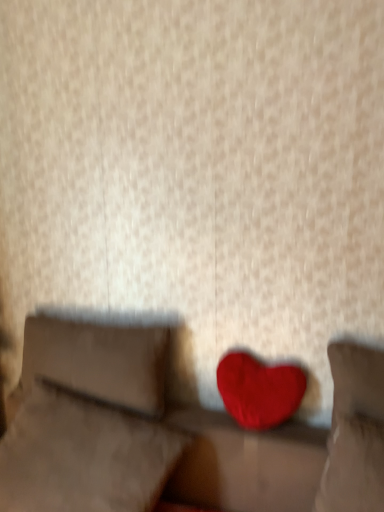
What do you see at coordinates (99, 361) in the screenshot? This screenshot has height=512, width=384. I see `suede-like beige pillow at left, the 1th pillow when ordered from left to right` at bounding box center [99, 361].

Locate an element on the screen. This screenshot has height=512, width=384. velvet red heart at center, arranged as the second pillow when viewed from the left is located at coordinates (83, 457).

Is velvet red heart at center, acting as the second pillow starting from the right, bigger than suede-like beige pillow at left, the third pillow positioned from the right?

Indeed, velvet red heart at center, acting as the second pillow starting from the right, has a larger size compared to suede-like beige pillow at left, the third pillow positioned from the right.

From the image's perspective, starting from the velvet red heart at center, acting as the second pillow starting from the right, which pillow is the 2nd one above? Please provide its 2D coordinates.

[(99, 361)]

Based on the photo, which object is positioned more to the left, velvet red heart at center, arranged as the second pillow when viewed from the left, or suede-like beige pillow at left, the third pillow positioned from the right?

suede-like beige pillow at left, the third pillow positioned from the right, is more to the left.

Is velvet red heart at center, acting as the second pillow starting from the right, positioned with its back to suede-like beige pillow at left, the third pillow positioned from the right?

Yes, velvet red heart at center, acting as the second pillow starting from the right, is positioned with its back facing suede-like beige pillow at left, the third pillow positioned from the right.

Which of these two, velvet red heart at center or velvet red heart at center, which appears as the 1th pillow when viewed from the right, is bigger?

With larger size is velvet red heart at center.

Where is `pillow lying on the right of velvet red heart at center`? This screenshot has height=512, width=384. pillow lying on the right of velvet red heart at center is located at coordinates (355, 431).

Is velvet red heart at center located outside velvet red heart at center, which ranks as the third pillow in left-to-right order?

Yes, velvet red heart at center is outside of velvet red heart at center, which ranks as the third pillow in left-to-right order.

Considering the relative sizes of velvet red heart at center and velvet red heart at center, which appears as the 1th pillow when viewed from the right, in the image provided, is velvet red heart at center shorter than velvet red heart at center, which appears as the 1th pillow when viewed from the right,?

No.

Can you confirm if velvet red heart at center, which appears as the 1th pillow when viewed from the right, is positioned to the left of velvet red heart at center?

In fact, velvet red heart at center, which appears as the 1th pillow when viewed from the right, is to the right of velvet red heart at center.

Between velvet red heart at center, which appears as the 1th pillow when viewed from the right, and velvet red heart at center, which one has larger size?

With larger size is velvet red heart at center.

How many degrees apart are the facing directions of velvet red heart at center, which ranks as the third pillow in left-to-right order, and velvet red heart at center?

0.98 degrees separate the facing orientations of velvet red heart at center, which ranks as the third pillow in left-to-right order, and velvet red heart at center.

Would you say velvet red heart at center, which ranks as the third pillow in left-to-right order, is outside velvet red heart at center?

Indeed, velvet red heart at center, which ranks as the third pillow in left-to-right order, is completely outside velvet red heart at center.

From the image's perspective, is velvet red heart at center, which ranks as the third pillow in left-to-right order, above velvet red heart at center, arranged as the second pillow when viewed from the left?

Correct, velvet red heart at center, which ranks as the third pillow in left-to-right order, appears higher than velvet red heart at center, arranged as the second pillow when viewed from the left, in the image.

In the image, is velvet red heart at center, which ranks as the third pillow in left-to-right order, on the left side or the right side of velvet red heart at center, acting as the second pillow starting from the right?

Based on their positions, velvet red heart at center, which ranks as the third pillow in left-to-right order, is located to the right of velvet red heart at center, acting as the second pillow starting from the right.

Is the surface of velvet red heart at center, which ranks as the third pillow in left-to-right order, in direct contact with velvet red heart at center, acting as the second pillow starting from the right?

They are not placed beside each other.

Considering the sizes of objects velvet red heart at center, which appears as the 1th pillow when viewed from the right, and velvet red heart at center, arranged as the second pillow when viewed from the left, in the image provided, who is smaller, velvet red heart at center, which appears as the 1th pillow when viewed from the right, or velvet red heart at center, arranged as the second pillow when viewed from the left,?

velvet red heart at center, which appears as the 1th pillow when viewed from the right.

From the picture: Is matte red heart at center facing towards velvet red heart at center, acting as the second pillow starting from the right?

No, matte red heart at center is not aimed at velvet red heart at center, acting as the second pillow starting from the right.

Is velvet red heart at center, arranged as the second pillow when viewed from the left, located within matte red heart at center?

No, matte red heart at center does not contain velvet red heart at center, arranged as the second pillow when viewed from the left.

Which object is closer to the camera taking this photo, matte red heart at center or velvet red heart at center, arranged as the second pillow when viewed from the left?

velvet red heart at center, arranged as the second pillow when viewed from the left, is closer to the camera.

In terms of size, does matte red heart at center appear bigger or smaller than velvet red heart at center, acting as the second pillow starting from the right?

Considering their sizes, matte red heart at center takes up less space than velvet red heart at center, acting as the second pillow starting from the right.

From the image's perspective, is velvet red heart at center, arranged as the second pillow when viewed from the left, below velvet red heart at center, which appears as the 1th pillow when viewed from the right?

Correct, velvet red heart at center, arranged as the second pillow when viewed from the left, appears lower than velvet red heart at center, which appears as the 1th pillow when viewed from the right, in the image.

Can you see velvet red heart at center, acting as the second pillow starting from the right, touching velvet red heart at center, which appears as the 1th pillow when viewed from the right?

No.

Could you tell me if velvet red heart at center, acting as the second pillow starting from the right, is turned towards velvet red heart at center, which appears as the 1th pillow when viewed from the right?

No, velvet red heart at center, acting as the second pillow starting from the right, does not turn towards velvet red heart at center, which appears as the 1th pillow when viewed from the right.

Is matte red heart at center wider than velvet red heart at center?

In fact, matte red heart at center might be narrower than velvet red heart at center.

Is there a large distance between matte red heart at center and velvet red heart at center?

No, matte red heart at center is not far from velvet red heart at center.

Is point (237, 420) closer or farther from the camera than point (101, 397)?

Point (237, 420) is positioned closer to the camera compared to point (101, 397).

At what (x,y) coordinates should I click in order to perform the action: click on pillow that is under the suede-like beige pillow at left, the third pillow positioned from the right (from a real-world perspective). Please return your answer as a coordinate pair (x, y). The height and width of the screenshot is (512, 384). Looking at the image, I should click on (83, 457).

Find the location of `pillow that is the 2nd object located behind the velvet red heart at center`. pillow that is the 2nd object located behind the velvet red heart at center is located at coordinates (355, 431).

Looking at the image, which one is located further to suede-like beige pillow at left, the 1th pillow when ordered from left to right, matte red heart at center or velvet red heart at center, which appears as the 1th pillow when viewed from the right?

velvet red heart at center, which appears as the 1th pillow when viewed from the right, is further to suede-like beige pillow at left, the 1th pillow when ordered from left to right.

From the image, which object appears to be farther from velvet red heart at center, which ranks as the third pillow in left-to-right order, velvet red heart at center or velvet red heart at center, arranged as the second pillow when viewed from the left?

The object further to velvet red heart at center, which ranks as the third pillow in left-to-right order, is velvet red heart at center, arranged as the second pillow when viewed from the left.

Which object lies nearer to the anchor point velvet red heart at center, acting as the second pillow starting from the right, velvet red heart at center, which appears as the 1th pillow when viewed from the right, or velvet red heart at center?

Based on the image, velvet red heart at center appears to be nearer to velvet red heart at center, acting as the second pillow starting from the right.

When comparing their distances from velvet red heart at center, does velvet red heart at center, which appears as the 1th pillow when viewed from the right, or suede-like beige pillow at left, the 1th pillow when ordered from left to right, seem further?

Among the two, velvet red heart at center, which appears as the 1th pillow when viewed from the right, is located further to velvet red heart at center.

Considering their positions, is velvet red heart at center, acting as the second pillow starting from the right, positioned closer to suede-like beige pillow at left, the 1th pillow when ordered from left to right, than velvet red heart at center?

velvet red heart at center is positioned closer to the anchor suede-like beige pillow at left, the 1th pillow when ordered from left to right.

Which object lies nearer to the anchor point velvet red heart at center, which ranks as the third pillow in left-to-right order, matte red heart at center or suede-like beige pillow at left, the third pillow positioned from the right?

matte red heart at center is positioned closer to the anchor velvet red heart at center, which ranks as the third pillow in left-to-right order.

Estimate the real-world distances between objects in this image. Which object is further from velvet red heart at center, which appears as the 1th pillow when viewed from the right, suede-like beige pillow at left, the 1th pillow when ordered from left to right, or velvet red heart at center?

Based on the image, suede-like beige pillow at left, the 1th pillow when ordered from left to right, appears to be further to velvet red heart at center, which appears as the 1th pillow when viewed from the right.

From the image, which object appears to be farther from suede-like beige pillow at left, the third pillow positioned from the right, velvet red heart at center, which appears as the 1th pillow when viewed from the right, or matte red heart at center?

Among the two, velvet red heart at center, which appears as the 1th pillow when viewed from the right, is located further to suede-like beige pillow at left, the third pillow positioned from the right.

At what (x,y) coordinates should I click in order to perform the action: click on heart located between velvet red heart at center and velvet red heart at center, which appears as the 1th pillow when viewed from the right, in the left-right direction. Please return your answer as a coordinate pair (x, y). Looking at the image, I should click on (259, 390).

The width and height of the screenshot is (384, 512). I want to click on furniture between suede-like beige pillow at left, the third pillow positioned from the right, and velvet red heart at center, which ranks as the third pillow in left-to-right order, from left to right, so click(x=176, y=432).

Identify the location of pillow between suede-like beige pillow at left, the third pillow positioned from the right, and velvet red heart at center, which ranks as the third pillow in left-to-right order, from left to right. This screenshot has height=512, width=384. (83, 457).

You are a GUI agent. You are given a task and a screenshot of the screen. Output one action in this format:
    pyautogui.click(x=<x>, y=<y>)
    Task: Click on the furniture located between velvet red heart at center, arranged as the second pillow when viewed from the left, and velvet red heart at center, which appears as the 1th pillow when viewed from the right, in the left-right direction
    
    Given the screenshot: What is the action you would take?
    pyautogui.click(x=176, y=432)